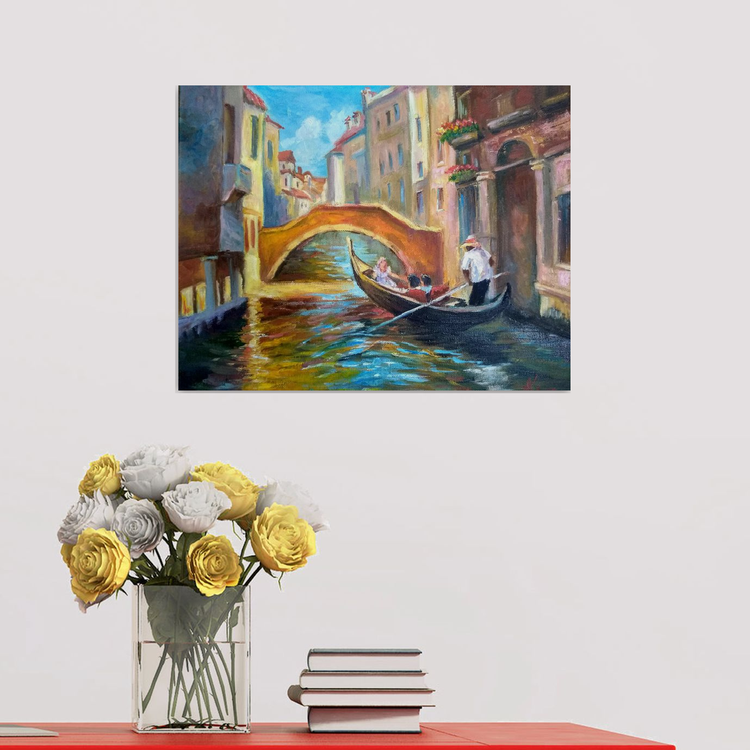
The width and height of the screenshot is (750, 750). I want to click on table, so pyautogui.click(x=511, y=727).